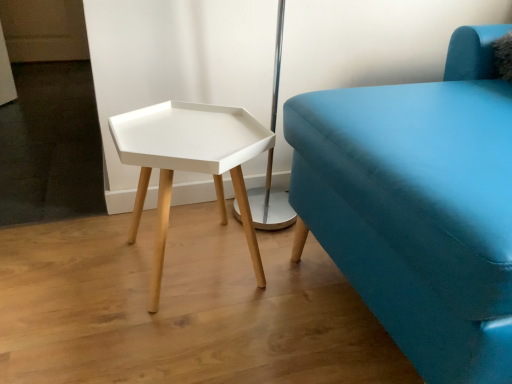
This screenshot has height=384, width=512. Describe the element at coordinates (189, 162) in the screenshot. I see `white matte hexagonal table at center` at that location.

Locate an element on the screen. white matte hexagonal table at center is located at coordinates (189, 162).

The image size is (512, 384). I want to click on matte blue fabric couch at right, so click(x=419, y=206).

What do you see at coordinates (419, 206) in the screenshot? The image size is (512, 384). I see `matte blue fabric couch at right` at bounding box center [419, 206].

Find the location of a particular element. white matte hexagonal table at center is located at coordinates (189, 162).

Based on their positions, is white matte hexagonal table at center located to the left or right of matte blue fabric couch at right?

white matte hexagonal table at center is to the left of matte blue fabric couch at right.

Is white matte hexagonal table at center in front of or behind matte blue fabric couch at right in the image?

white matte hexagonal table at center is positioned farther from the viewer than matte blue fabric couch at right.

Considering the points (259, 269) and (462, 93), which point is in front, point (259, 269) or point (462, 93)?

The point (462, 93) is in front.

From the image's perspective, is white matte hexagonal table at center above or below matte blue fabric couch at right?

Based on their image positions, white matte hexagonal table at center is located beneath matte blue fabric couch at right.

From a real-world perspective, between white matte hexagonal table at center and matte blue fabric couch at right, who is vertically lower?

In real-world perspective, white matte hexagonal table at center is lower.

Considering the relative sizes of white matte hexagonal table at center and matte blue fabric couch at right in the image provided, is white matte hexagonal table at center thinner than matte blue fabric couch at right?

Yes.

Does white matte hexagonal table at center have a lesser height compared to matte blue fabric couch at right?

Correct, white matte hexagonal table at center is not as tall as matte blue fabric couch at right.

Considering the relative sizes of white matte hexagonal table at center and matte blue fabric couch at right in the image provided, is white matte hexagonal table at center bigger than matte blue fabric couch at right?

Actually, white matte hexagonal table at center might be smaller than matte blue fabric couch at right.

Is matte blue fabric couch at right located within white matte hexagonal table at center?

Definitely not — matte blue fabric couch at right is not inside white matte hexagonal table at center.

Are white matte hexagonal table at center and matte blue fabric couch at right located far from each other?

No, white matte hexagonal table at center is not far from matte blue fabric couch at right.

Is white matte hexagonal table at center aimed at matte blue fabric couch at right?

No, white matte hexagonal table at center is not aimed at matte blue fabric couch at right.

Locate an element on the screen. This screenshot has width=512, height=384. table below the matte blue fabric couch at right (from the image's perspective) is located at coordinates pos(189,162).

In the image, is matte blue fabric couch at right on the left side or the right side of white matte hexagonal table at center?

matte blue fabric couch at right is to the right of white matte hexagonal table at center.

Considering their positions, is matte blue fabric couch at right located in front of or behind white matte hexagonal table at center?

Clearly, matte blue fabric couch at right is in front of white matte hexagonal table at center.

Which is closer, (388, 142) or (274, 141)?

Clearly, point (388, 142) is closer to the camera than point (274, 141).

From the image's perspective, is matte blue fabric couch at right below white matte hexagonal table at center?

No, from the image's perspective, matte blue fabric couch at right is not beneath white matte hexagonal table at center.

From a real-world perspective, is matte blue fabric couch at right positioned over white matte hexagonal table at center based on gravity?

Indeed, from a real-world perspective, matte blue fabric couch at right stands above white matte hexagonal table at center.

Considering the sizes of matte blue fabric couch at right and white matte hexagonal table at center in the image, is matte blue fabric couch at right wider or thinner than white matte hexagonal table at center?

Clearly, matte blue fabric couch at right has more width compared to white matte hexagonal table at center.

Is matte blue fabric couch at right taller or shorter than white matte hexagonal table at center?

Clearly, matte blue fabric couch at right is taller compared to white matte hexagonal table at center.

Between matte blue fabric couch at right and white matte hexagonal table at center, which one has smaller size?

Smaller between the two is white matte hexagonal table at center.

Is matte blue fabric couch at right surrounding white matte hexagonal table at center?

Actually, white matte hexagonal table at center is outside matte blue fabric couch at right.

Consider the image. Is matte blue fabric couch at right not close to white matte hexagonal table at center?

No.

Is matte blue fabric couch at right oriented away from white matte hexagonal table at center?

That's not correct — matte blue fabric couch at right is not looking away from white matte hexagonal table at center.

I want to click on table on the left of matte blue fabric couch at right, so click(x=189, y=162).

In order to click on table below the matte blue fabric couch at right (from a real-world perspective) in this screenshot , I will do `click(189, 162)`.

I want to click on table located on the left of matte blue fabric couch at right, so click(189, 162).